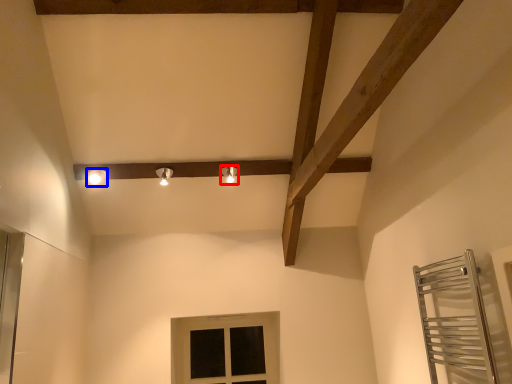
Question: Among these objects, which one is farthest to the camera, light fixture (highlighted by a red box) or light fixture (highlighted by a blue box)?

Choices:
 (A) light fixture
 (B) light fixture

Answer: (A)